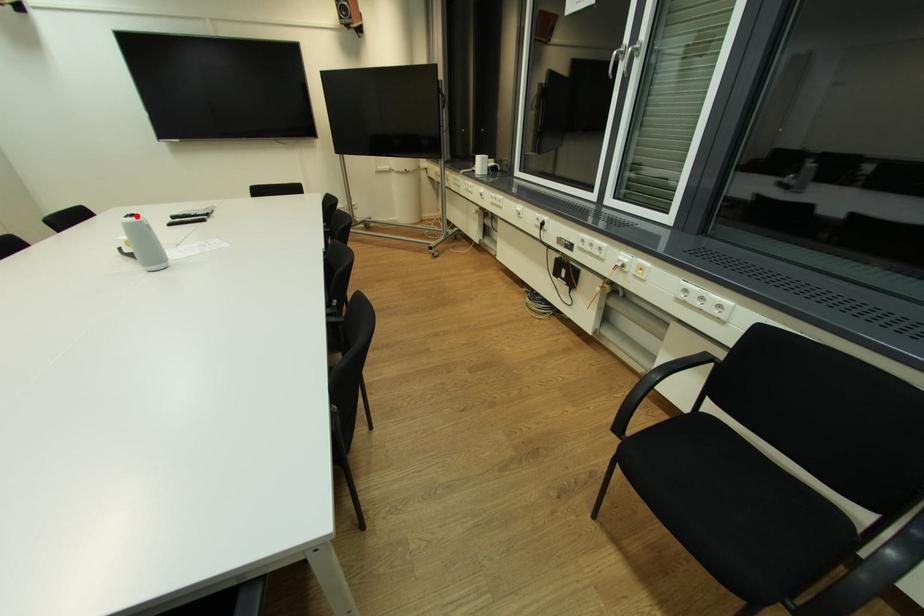
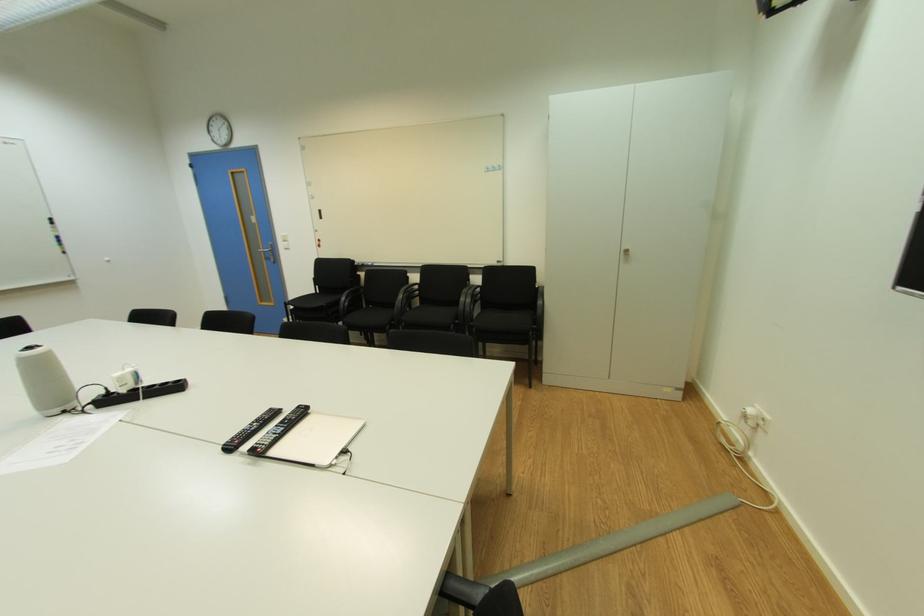
Find the pixel in the second image that matches the highlighted location in the first image.

(34, 349)